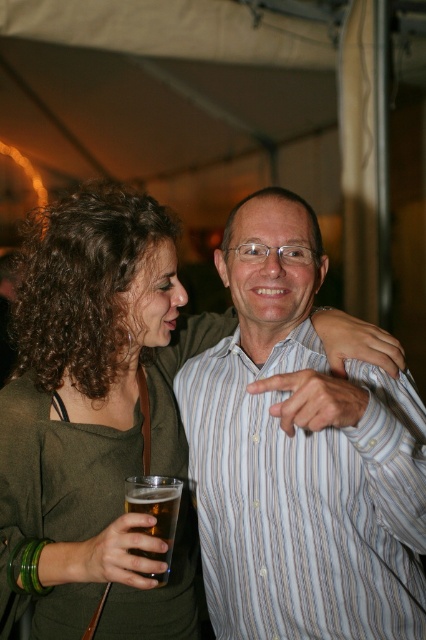
You are at a social gathering and see two points in the image. The first point is at coordinates point (348, 492) and the second is at point (135, 480). If you were to walk towards both points, which one would you reach first?

Point (348, 492) is closer to you than point (135, 480), so you would reach point (348, 492) first.

You are a photographer at the event and want to capture a clear photo of both the striped cotton shirt at center and the translucent glass beer at lower left. Which object should you focus on first to ensure both are in focus?

The striped cotton shirt at center is closer to the viewer than the translucent glass beer at lower left. To ensure both are in focus, you should focus on the striped cotton shirt at center first, as it is closer, and the depth of field may naturally include the farther object if focused properly on the nearer one.

You are at a party and see a person wearing a striped cotton shirt at center. They are pointing towards something. Where exactly is their finger pointing to? The coordinates given are point (305, 500). Can you determine the location of this point relative to the striped cotton shirt at center?

The point (305, 500) is located on the striped cotton shirt at center, meaning the person is pointing directly at their own shirt.